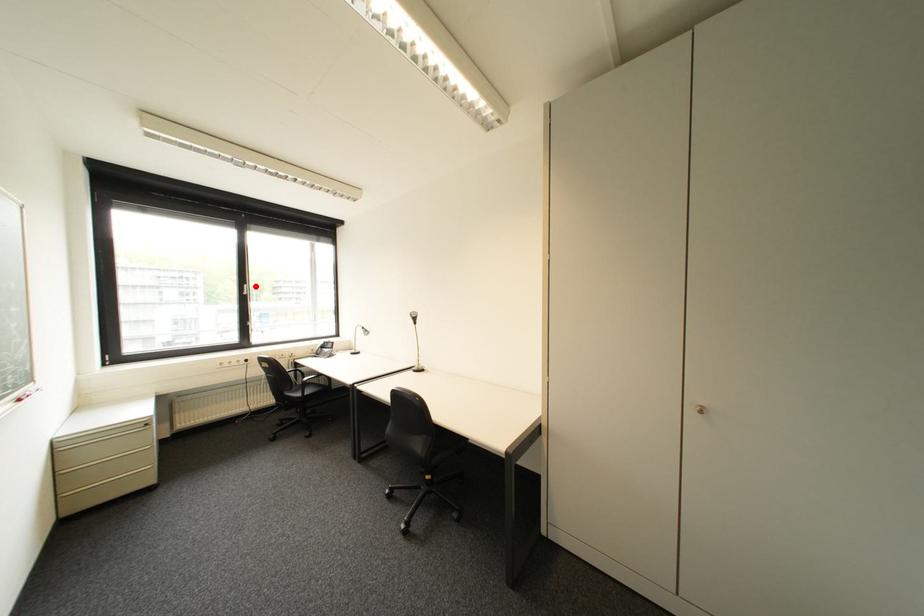
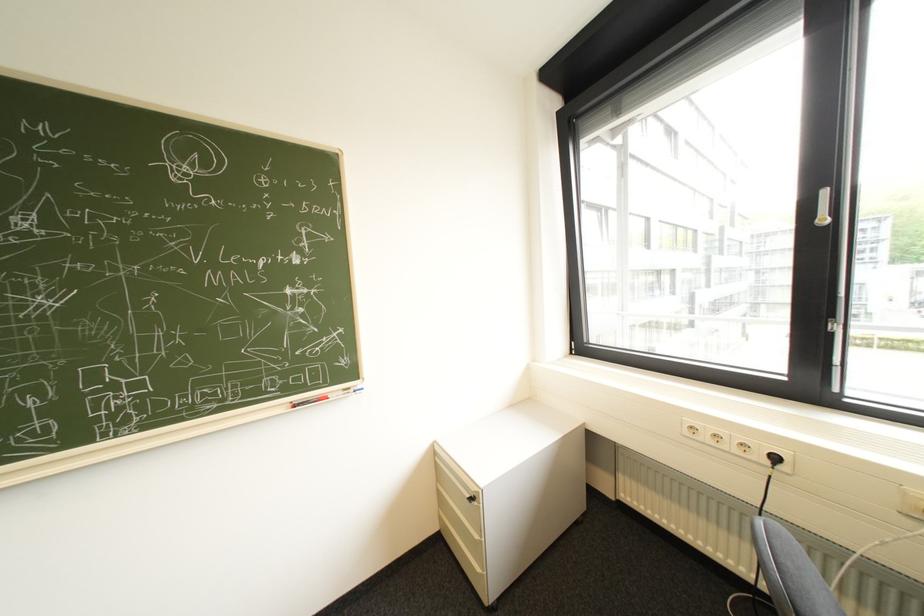
The point at the highlighted location is marked in the first image. Where is the corresponding point in the second image?

(834, 193)